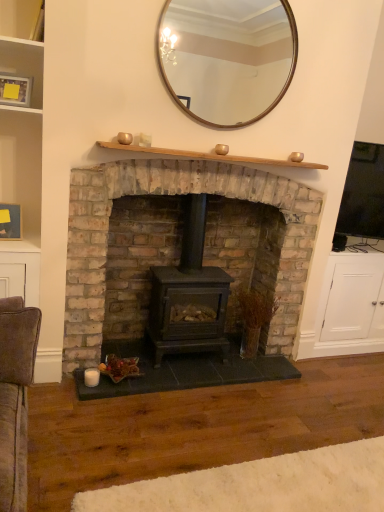
Identify the location of vacant region above white wool rug at lower center (from a real-world perspective). (275, 483).